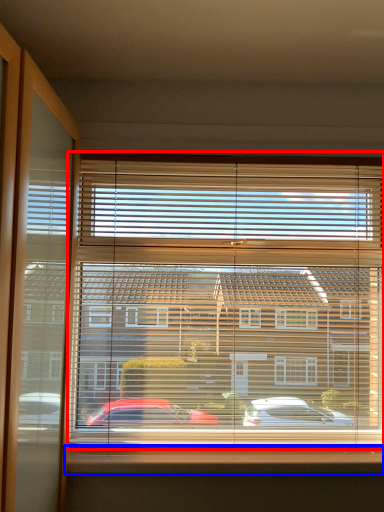
Question: Which of the following is the farthest to the observer, window blind (highlighted by a red box) or window sill (highlighted by a blue box)?

Choices:
 (A) window blind
 (B) window sill

Answer: (A)